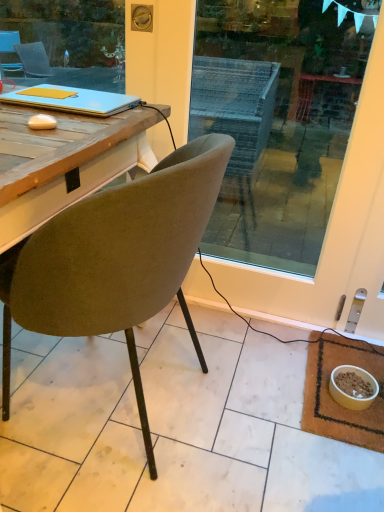
Question: Can you confirm if matte blue laptop at upper left is thinner than yellow matte bowl at lower right?

Choices:
 (A) yes
 (B) no

Answer: (B)

Question: Is matte blue laptop at upper left behind yellow matte bowl at lower right?

Choices:
 (A) yes
 (B) no

Answer: (B)

Question: Considering the relative positions of matte blue laptop at upper left and yellow matte bowl at lower right in the image provided, is matte blue laptop at upper left to the left of yellow matte bowl at lower right from the viewer's perspective?

Choices:
 (A) yes
 (B) no

Answer: (A)

Question: From a real-world perspective, is matte blue laptop at upper left under yellow matte bowl at lower right?

Choices:
 (A) no
 (B) yes

Answer: (A)

Question: Is matte blue laptop at upper left outside yellow matte bowl at lower right?

Choices:
 (A) no
 (B) yes

Answer: (B)

Question: Is point [x=135, y=393] positioned closer to the camera than point [x=365, y=401]?

Choices:
 (A) closer
 (B) farther

Answer: (A)

Question: Visually, is velvet olive chair at center positioned to the left or to the right of yellow matte bowl at lower right?

Choices:
 (A) left
 (B) right

Answer: (A)

Question: Considering the positions of velvet olive chair at center and yellow matte bowl at lower right in the image, is velvet olive chair at center taller or shorter than yellow matte bowl at lower right?

Choices:
 (A) tall
 (B) short

Answer: (A)

Question: Which is correct: velvet olive chair at center is inside yellow matte bowl at lower right, or outside of it?

Choices:
 (A) inside
 (B) outside

Answer: (B)

Question: From their relative heights in the image, would you say matte blue laptop at upper left is taller or shorter than brown woven mat at lower right?

Choices:
 (A) tall
 (B) short

Answer: (A)

Question: In the image, is matte blue laptop at upper left positioned in front of or behind brown woven mat at lower right?

Choices:
 (A) front
 (B) behind

Answer: (A)

Question: Would you say matte blue laptop at upper left is inside or outside brown woven mat at lower right?

Choices:
 (A) outside
 (B) inside

Answer: (A)

Question: In terms of width, does matte blue laptop at upper left look wider or thinner when compared to brown woven mat at lower right?

Choices:
 (A) wide
 (B) thin

Answer: (B)

Question: Is point (215, 136) closer or farther from the camera than point (326, 357)?

Choices:
 (A) farther
 (B) closer

Answer: (B)

Question: Is velvet olive chair at center to the left or to the right of brown woven mat at lower right in the image?

Choices:
 (A) left
 (B) right

Answer: (A)